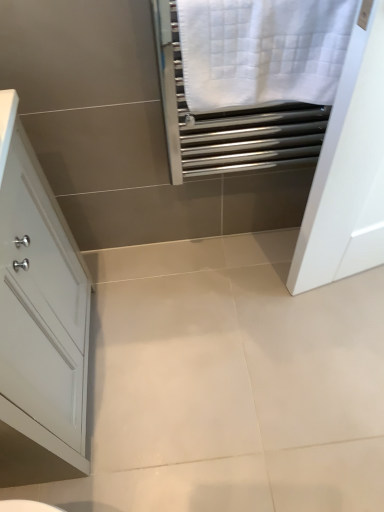
Find the location of `white glossy cabinet at left`. white glossy cabinet at left is located at coordinates (38, 321).

The height and width of the screenshot is (512, 384). What do you see at coordinates (38, 321) in the screenshot?
I see `white glossy cabinet at left` at bounding box center [38, 321].

You are a GUI agent. You are given a task and a screenshot of the screen. Output one action in this format:
    pyautogui.click(x=<x>, y=<y>)
    Task: Click on the white textured towel at upper right
    Image resolution: width=384 pixels, height=512 pixels.
    Given the screenshot: What is the action you would take?
    pyautogui.click(x=262, y=51)

The height and width of the screenshot is (512, 384). Describe the element at coordinates (262, 51) in the screenshot. I see `white textured towel at upper right` at that location.

You are a GUI agent. You are given a task and a screenshot of the screen. Output one action in this format:
    pyautogui.click(x=<x>, y=<y>)
    Task: Click on the white glossy cabinet at left
    The width and height of the screenshot is (384, 512).
    Given the screenshot: What is the action you would take?
    [x=38, y=321]

Considering the relative positions of white glossy cabinet at left and white textured towel at upper right in the image provided, is white glossy cabinet at left to the left of white textured towel at upper right from the viewer's perspective?

Yes, white glossy cabinet at left is to the left of white textured towel at upper right.

Which object is closer to the camera taking this photo, white glossy cabinet at left or white textured towel at upper right?

white glossy cabinet at left is more forward.

Does point (65, 410) come farther from viewer compared to point (303, 90)?

Yes, point (65, 410) is farther from viewer.

From the image's perspective, is white glossy cabinet at left positioned above or below white textured towel at upper right?

white glossy cabinet at left is situated lower than white textured towel at upper right in the image.

From a real-world perspective, does white glossy cabinet at left stand above white textured towel at upper right?

Incorrect, from a real-world perspective, white glossy cabinet at left is lower than white textured towel at upper right.

Which object is thinner, white glossy cabinet at left or white textured towel at upper right?

Thinner between the two is white textured towel at upper right.

Can you confirm if white glossy cabinet at left is taller than white textured towel at upper right?

Yes, white glossy cabinet at left is taller than white textured towel at upper right.

Which of these two, white glossy cabinet at left or white textured towel at upper right, is bigger?

white glossy cabinet at left is bigger.

Is white glossy cabinet at left not within white textured towel at upper right?

That's correct, white glossy cabinet at left is outside of white textured towel at upper right.

Is white glossy cabinet at left next to white textured towel at upper right and touching it?

They are not placed beside each other.

Is white glossy cabinet at left aimed at white textured towel at upper right?

Yes.

Measure the distance from white glossy cabinet at left to white textured towel at upper right.

white glossy cabinet at left and white textured towel at upper right are 23.49 inches apart.

Find the location of a particular element. The width and height of the screenshot is (384, 512). bath towel that appears above the white glossy cabinet at left (from the image's perspective) is located at coordinates (262, 51).

In the image, is white textured towel at upper right on the left side or the right side of white glossy cabinet at left?

white textured towel at upper right is to the right of white glossy cabinet at left.

Who is more distant, white textured towel at upper right or white glossy cabinet at left?

white textured towel at upper right is more distant.

Which point is more distant from viewer, (216, 108) or (34, 391)?

Positioned behind is point (216, 108).

From the image's perspective, who appears lower, white textured towel at upper right or white glossy cabinet at left?

white glossy cabinet at left is shown below in the image.

From a real-world perspective, between white textured towel at upper right and white glossy cabinet at left, who is vertically lower?

In real-world perspective, white glossy cabinet at left is lower.

Considering the sizes of white textured towel at upper right and white glossy cabinet at left in the image, is white textured towel at upper right wider or thinner than white glossy cabinet at left?

Clearly, white textured towel at upper right has less width compared to white glossy cabinet at left.

Between white textured towel at upper right and white glossy cabinet at left, which one has more height?

Standing taller between the two is white glossy cabinet at left.

Between white textured towel at upper right and white glossy cabinet at left, which one has larger size?

white glossy cabinet at left.

Is white glossy cabinet at left inside white textured towel at upper right?

No, white textured towel at upper right does not contain white glossy cabinet at left.

Is white textured towel at upper right next to white glossy cabinet at left?

No, white textured towel at upper right is not with white glossy cabinet at left.

Is white glossy cabinet at left at the back of white textured towel at upper right?

That's not correct — white textured towel at upper right is not looking away from white glossy cabinet at left.

How many degrees apart are the facing directions of white textured towel at upper right and white glossy cabinet at left?

The facing directions of white textured towel at upper right and white glossy cabinet at left are 89.3 degrees apart.

Locate an element on the screen. bathroom cabinet below the white textured towel at upper right (from the image's perspective) is located at coordinates (38, 321).

The width and height of the screenshot is (384, 512). What are the coordinates of `bath towel behind the white glossy cabinet at left` in the screenshot? It's located at (262, 51).

Find the location of `bath towel on the right side of white glossy cabinet at left`. bath towel on the right side of white glossy cabinet at left is located at coordinates (262, 51).